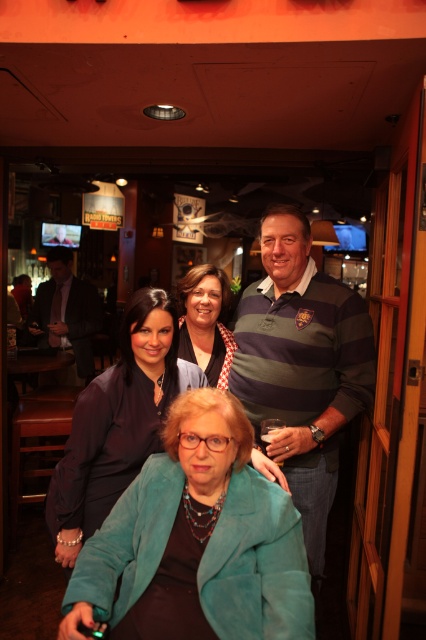
Based on the photo, is teal fabric jacket at lower center bigger than matte black shirt at center?

Yes.

The height and width of the screenshot is (640, 426). Identify the location of teal fabric jacket at lower center. (118, 422).

Who is more forward, (63, 502) or (187, 323)?

Point (63, 502) is more forward.

What are the coordinates of `teal fabric jacket at lower center` in the screenshot? It's located at (118, 422).

Between teal fabric jacket at lower center and dark gray suit at left, which one is positioned higher?

dark gray suit at left is above.

Which is in front, point (51, 520) or point (37, 291)?

Point (51, 520)

Between point (100, 474) and point (89, 291), which one is positioned behind?

Point (89, 291)

Identify the location of teal fabric jacket at lower center. (118, 422).

Based on the photo, can you confirm if striped polo shirt at center is positioned above dark gray suit at left?

No, striped polo shirt at center is not above dark gray suit at left.

Identify the location of striped polo shirt at center. The width and height of the screenshot is (426, 640). (302, 365).